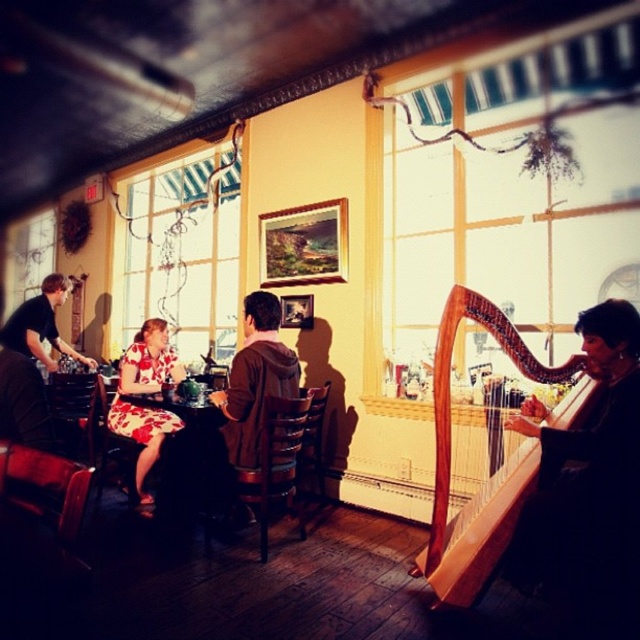
How much distance is there between floral dress at center and wooden table at center?

floral dress at center is 11.22 inches away from wooden table at center.

From the picture: Does floral dress at center have a larger size compared to wooden table at center?

No.

Between point (136, 420) and point (168, 492), which one is positioned behind?

The point (136, 420) is behind.

Find the location of `floral dress at center`. floral dress at center is located at coordinates (145, 394).

Between point (8, 404) and point (168, 461), which one is positioned behind?

Point (168, 461)

What do you see at coordinates (32, 365) in the screenshot? The height and width of the screenshot is (640, 640). I see `black leather jacket at left` at bounding box center [32, 365].

Identify the location of black leather jacket at left. This screenshot has height=640, width=640. (32, 365).

Between brown hoodie at center and floral dress at center, which one appears on the right side from the viewer's perspective?

brown hoodie at center

Is point (228, 436) less distant than point (163, 413)?

That is True.

Where is `brown hoodie at center`? The width and height of the screenshot is (640, 640). brown hoodie at center is located at coordinates (256, 380).